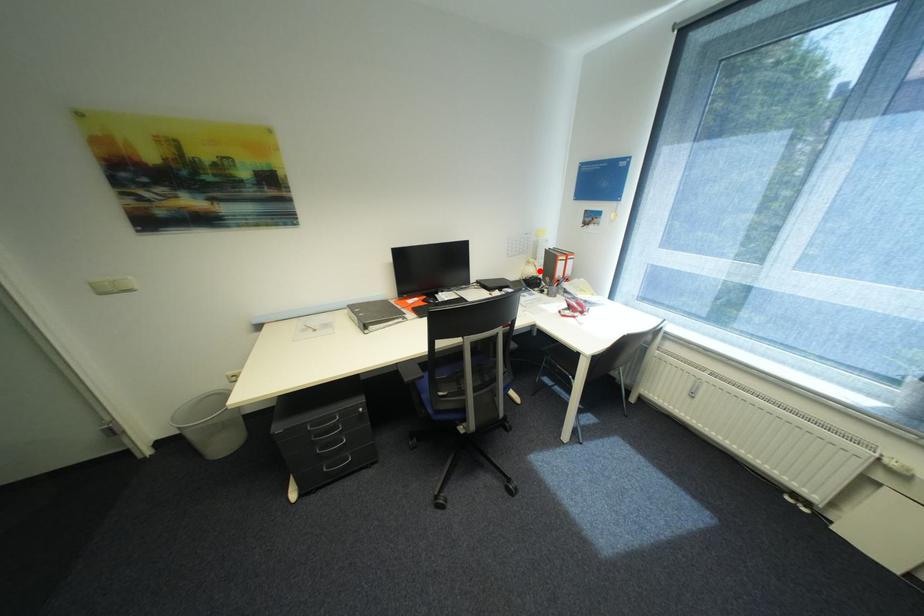
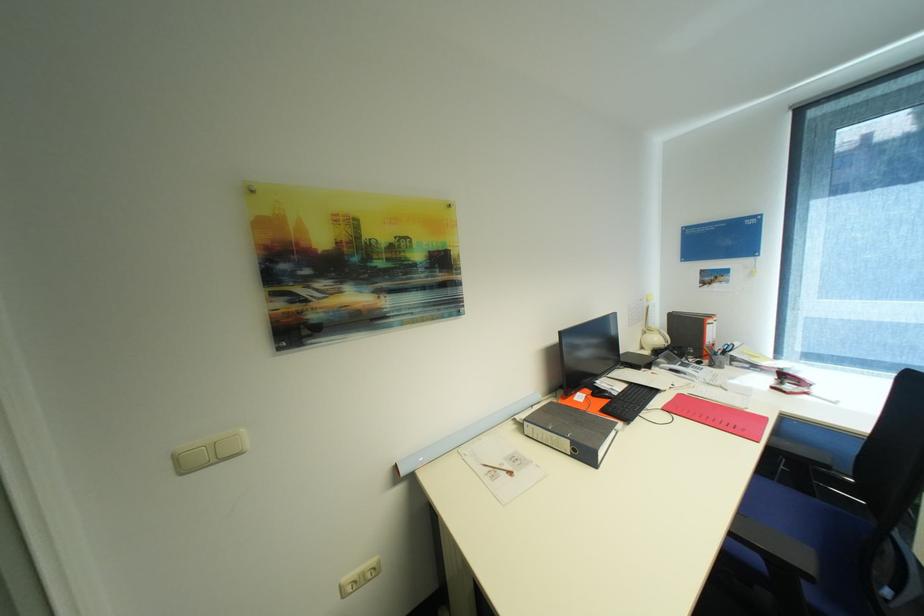
In the second image, find the point that corresponds to the highlighted location in the first image.

(663, 339)